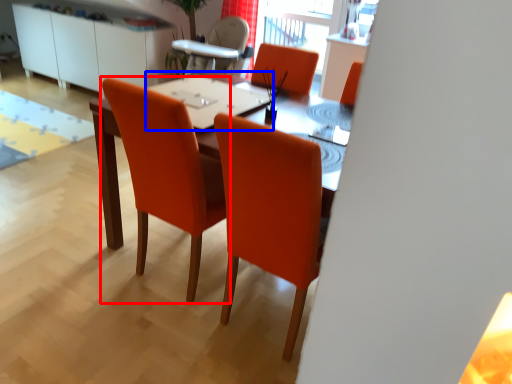
Question: Which of the following is the farthest to the observer, chair (highlighted by a red box) or table top (highlighted by a blue box)?

Choices:
 (A) chair
 (B) table top

Answer: (B)